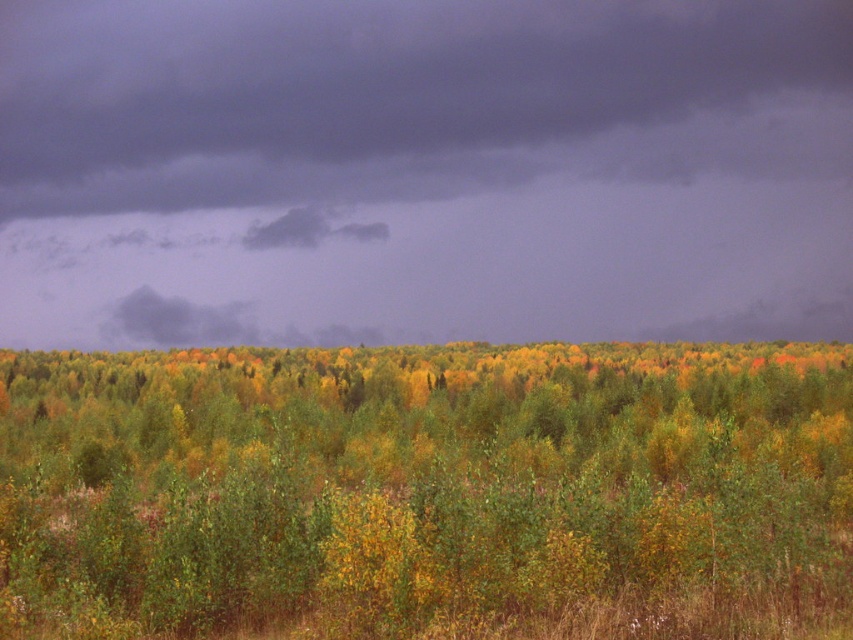
You are standing in the field of low vegetation and want to walk towards the green leafy forest at center. Which direction should you walk to avoid the dark gray cloud at upper center?

The dark gray cloud at upper center is to the left of the green leafy forest at center, so you should walk to the right of the forest to avoid the cloud.

You are a weather observer positioned at the origin point of the landscape. You need to report the position of the dark gray cloud at upper center. What are its coordinates?

The dark gray cloud at upper center is located at coordinates point (422, 170).

You are a weather observer in the field of low vegetation. You need to report the size comparison between the dark gray cloud at upper center and the green leafy forest at center. Which one is bigger?

The dark gray cloud at upper center is larger in size than the green leafy forest at center.